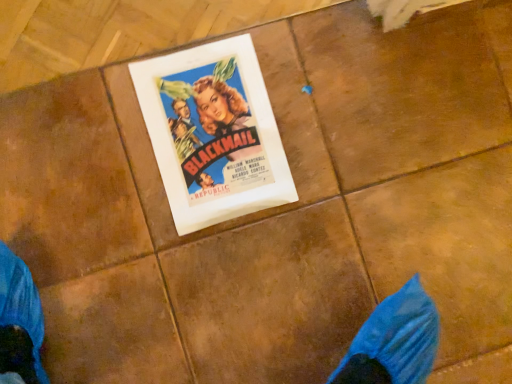
You are a GUI agent. You are given a task and a screenshot of the screen. Output one action in this format:
    pyautogui.click(x=<x>, y=<y>)
    Task: Click on the matte paper poster at center
    The image size is (512, 384).
    Given the screenshot: What is the action you would take?
    pyautogui.click(x=213, y=133)

Describe the element at coordinates (213, 133) in the screenshot. I see `matte paper poster at center` at that location.

Identify the location of matte paper poster at center. (213, 133).